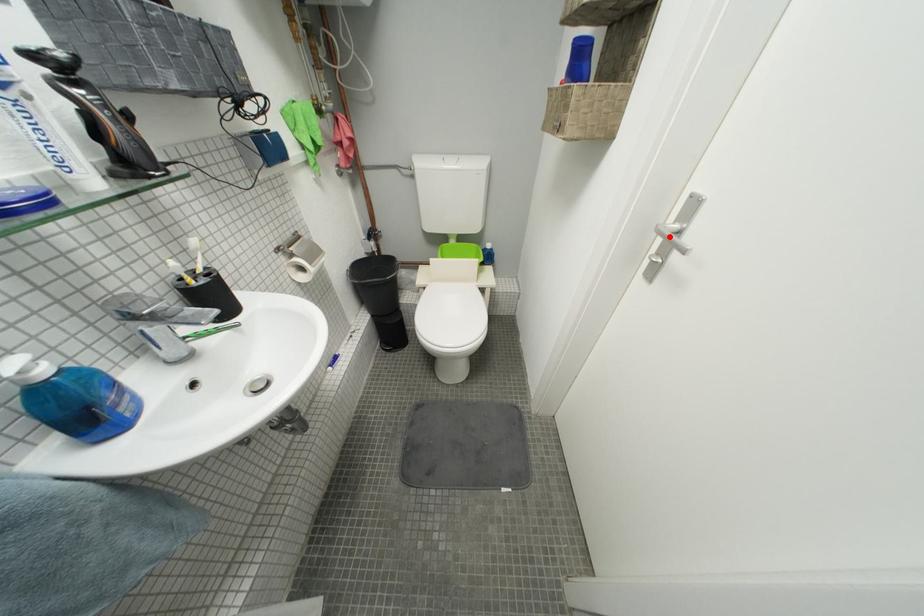
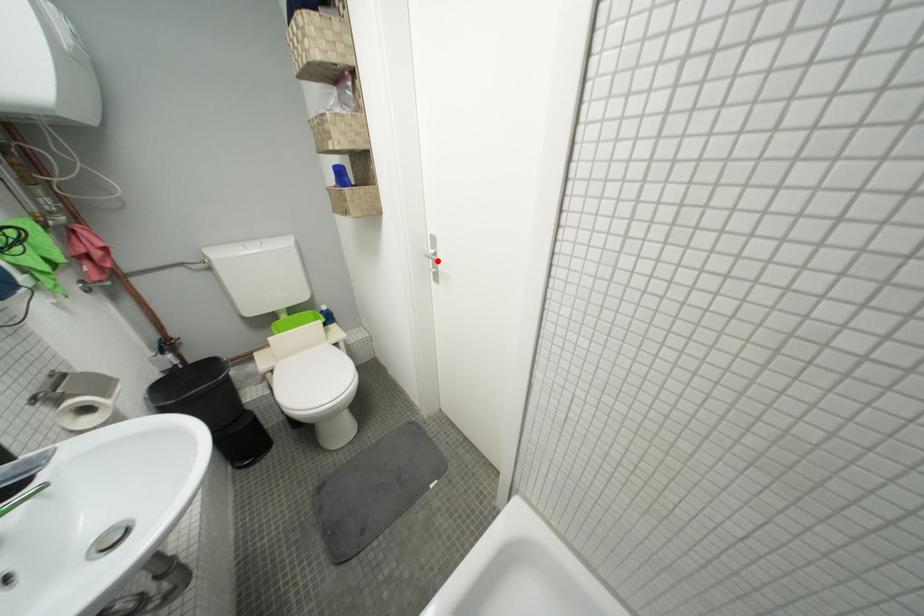
I am providing you with two images of the same scene from different viewpoints. A red point is marked on the first image and another point is marked on the second image. Are the points marked in image1 and image2 representing the same 3D position?

Yes